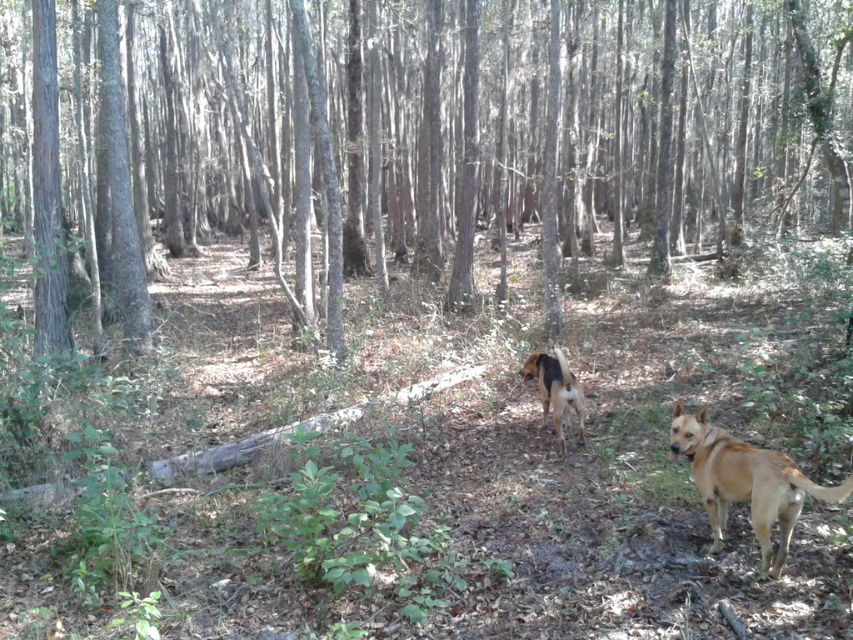
Is brown textured tree at center to the left of light brown fur dog at lower right from the viewer's perspective?

Yes, brown textured tree at center is to the left of light brown fur dog at lower right.

Does point (784, 52) come behind point (703, 452)?

Yes, point (784, 52) is farther from viewer.

Image resolution: width=853 pixels, height=640 pixels. I want to click on brown textured tree at center, so click(506, 129).

At what (x,y) coordinates should I click in order to perform the action: click on brown textured tree at center. Please return your answer as a coordinate pair (x, y). The width and height of the screenshot is (853, 640). Looking at the image, I should click on (506, 129).

Is light brown fur dog at lower right thinner than brown furry dog at center?

No, light brown fur dog at lower right is not thinner than brown furry dog at center.

Does light brown fur dog at lower right appear on the right side of brown furry dog at center?

Yes, light brown fur dog at lower right is to the right of brown furry dog at center.

Which is behind, point (837, 490) or point (543, 387)?

The point (543, 387) is more distant.

Locate an element on the screen. The image size is (853, 640). light brown fur dog at lower right is located at coordinates (746, 483).

Consider the image. Who is positioned more to the right, brown textured tree at center or brown furry dog at center?

Positioned to the right is brown furry dog at center.

In the scene shown: Can you confirm if brown textured tree at center is positioned to the left of brown furry dog at center?

Correct, you'll find brown textured tree at center to the left of brown furry dog at center.

Which is in front, point (132, 108) or point (556, 412)?

Point (556, 412) is in front.

Where is `brown textured tree at center`? brown textured tree at center is located at coordinates (506, 129).